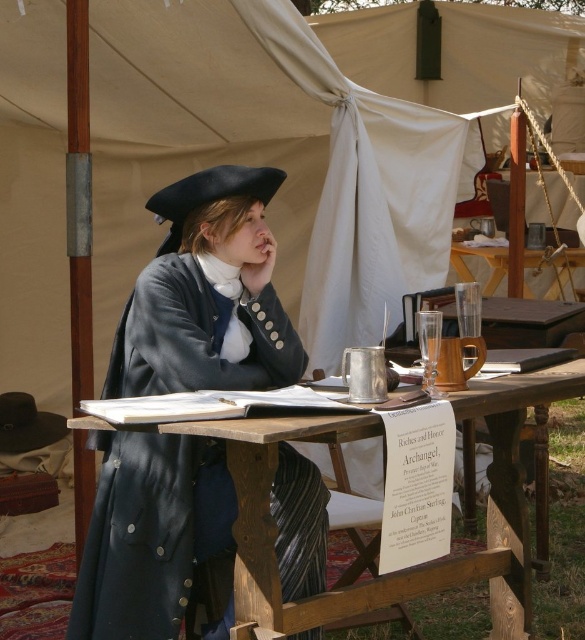
Question: Considering the relative positions of matte black coat at center and wooden picnic table at center in the image provided, where is matte black coat at center located with respect to wooden picnic table at center?

Choices:
 (A) left
 (B) right

Answer: (A)

Question: Which object is closer to the camera taking this photo?

Choices:
 (A) matte black coat at center
 (B) wooden picnic table at center

Answer: (B)

Question: Which of the following is the closest to the observer?

Choices:
 (A) (314, 576)
 (B) (449, 568)

Answer: (A)

Question: Which object is closer to the camera taking this photo?

Choices:
 (A) matte black coat at center
 (B) wooden picnic table at center

Answer: (B)

Question: Can you confirm if matte black coat at center is bigger than wooden picnic table at center?

Choices:
 (A) yes
 (B) no

Answer: (B)

Question: Does matte black coat at center lie behind wooden picnic table at center?

Choices:
 (A) yes
 (B) no

Answer: (A)